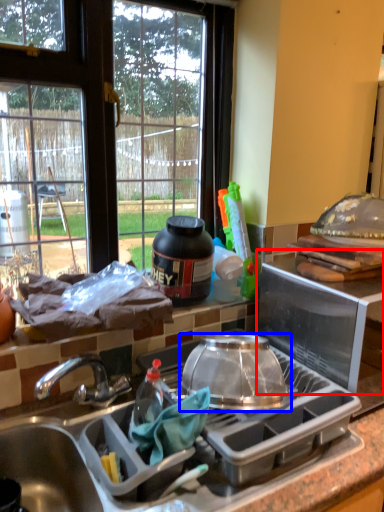
Question: Which object appears farthest to the camera in this image, appliance (highlighted by a red box) or kitchen appliance (highlighted by a blue box)?

Choices:
 (A) appliance
 (B) kitchen appliance

Answer: (A)